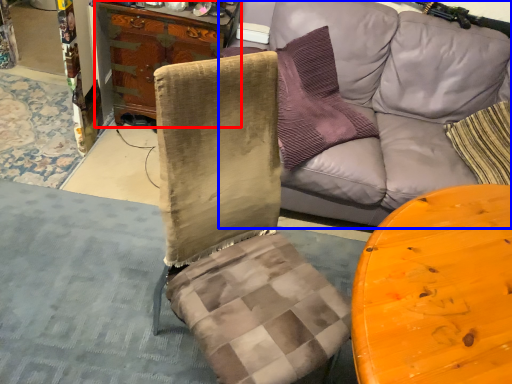
Question: Which of the following is the farthest to the observer, cabinetry (highlighted by a red box) or studio couch (highlighted by a blue box)?

Choices:
 (A) cabinetry
 (B) studio couch

Answer: (A)